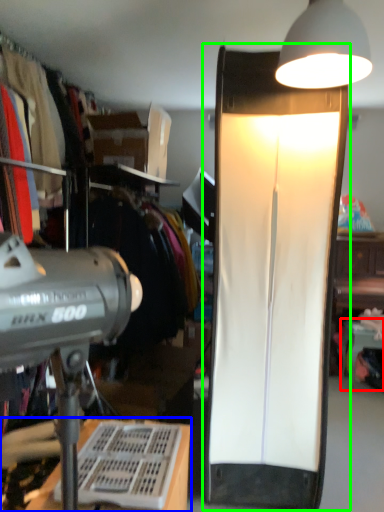
Question: Considering the real-world distances, which object is closest to table (highlighted by a red box)? desk (highlighted by a blue box) or lamp (highlighted by a green box).

Choices:
 (A) desk
 (B) lamp

Answer: (B)